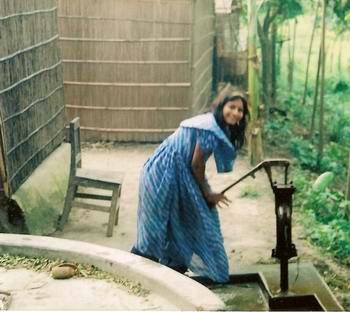
The image size is (350, 312). I want to click on chair, so click(104, 175).